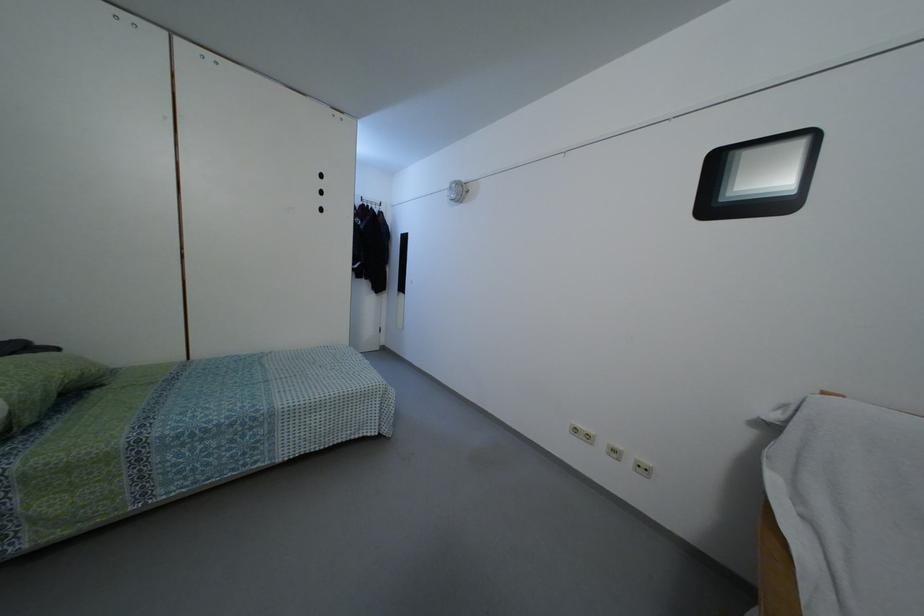
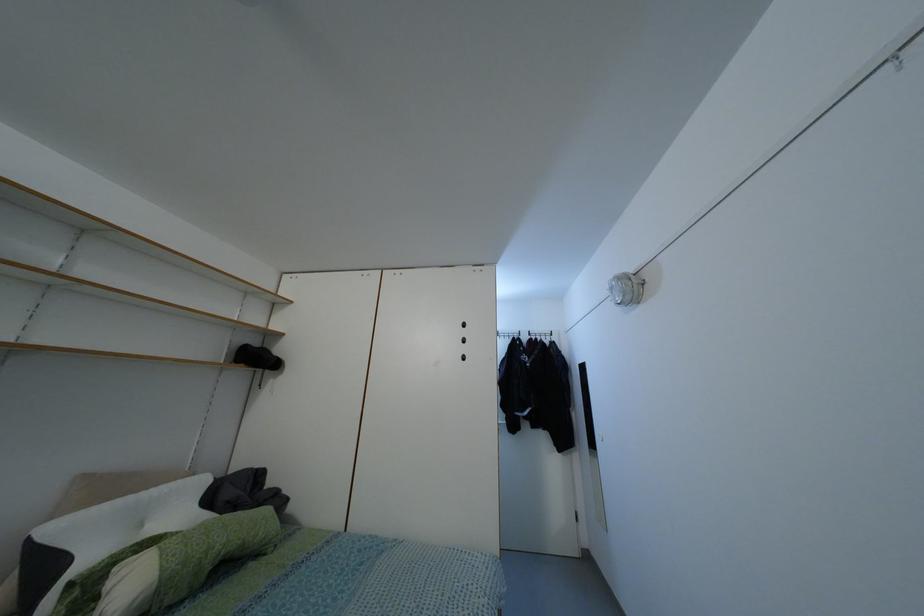
How did the camera likely rotate?

The camera's rotation is toward left-up.